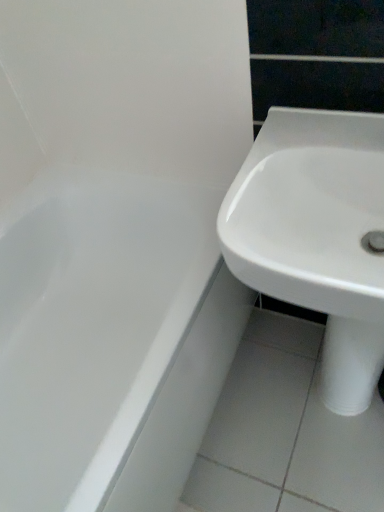
Question: Is white glossy bathtub at left thinner than white glossy sink at right?

Choices:
 (A) no
 (B) yes

Answer: (A)

Question: Does white glossy bathtub at left appear on the right side of white glossy sink at right?

Choices:
 (A) no
 (B) yes

Answer: (A)

Question: From a real-world perspective, is white glossy bathtub at left located higher than white glossy sink at right?

Choices:
 (A) no
 (B) yes

Answer: (A)

Question: Considering the relative positions of white glossy bathtub at left and white glossy sink at right in the image provided, is white glossy bathtub at left in front of white glossy sink at right?

Choices:
 (A) no
 (B) yes

Answer: (A)

Question: Is white glossy bathtub at left not near white glossy sink at right?

Choices:
 (A) yes
 (B) no

Answer: (B)

Question: Is white glossy bathtub at left to the left of white glossy sink at right from the viewer's perspective?

Choices:
 (A) yes
 (B) no

Answer: (A)

Question: From the image's perspective, is white glossy sink at right above white glossy bathtub at left?

Choices:
 (A) yes
 (B) no

Answer: (A)

Question: Is white glossy sink at right oriented away from white glossy bathtub at left?

Choices:
 (A) no
 (B) yes

Answer: (A)

Question: Considering the relative sizes of white glossy sink at right and white glossy bathtub at left in the image provided, is white glossy sink at right taller than white glossy bathtub at left?

Choices:
 (A) yes
 (B) no

Answer: (B)

Question: Is white glossy sink at right not within white glossy bathtub at left?

Choices:
 (A) yes
 (B) no

Answer: (A)

Question: Would you say white glossy sink at right contains white glossy bathtub at left?

Choices:
 (A) yes
 (B) no

Answer: (B)

Question: From the image's perspective, is white glossy sink at right located beneath white glossy bathtub at left?

Choices:
 (A) no
 (B) yes

Answer: (A)

Question: From the image's perspective, is white glossy bathtub at left located above or below white glossy sink at right?

Choices:
 (A) below
 (B) above

Answer: (A)